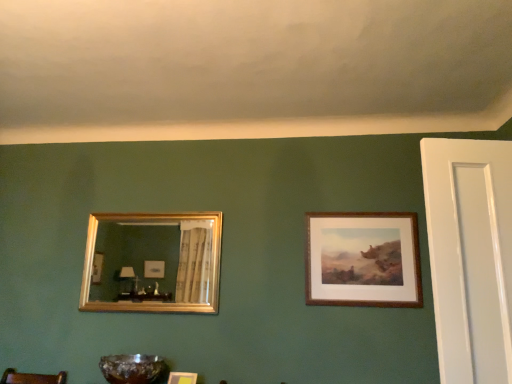
Find the location of a particular element. Image resolution: width=512 pixels, height=384 pixels. wooden picture frame at lower center, which is the 2th picture frame from left to right is located at coordinates (182, 378).

Based on the photo, how different are the orientations of wooden picture frame at lower center, which is counted as the second picture frame, starting from the right, and gold-framed mirror at left, which is the first picture frame from left to right, in degrees?

The angle between the facing direction of wooden picture frame at lower center, which is counted as the second picture frame, starting from the right, and the facing direction of gold-framed mirror at left, which is the first picture frame from left to right, is 0.134 degrees.

Locate an element on the screen. The width and height of the screenshot is (512, 384). picture frame that appears below the gold-framed mirror at left, the 3th picture frame in the right-to-left sequence (from the image's perspective) is located at coordinates (182, 378).

Who is bigger, wooden picture frame at lower center, which is the 2th picture frame from left to right, or gold-framed mirror at left, the 3th picture frame in the right-to-left sequence?

With larger size is gold-framed mirror at left, the 3th picture frame in the right-to-left sequence.

Considering the relative positions of wooden picture frame at lower center, which is counted as the second picture frame, starting from the right, and gold-framed mirror at left, which is the first picture frame from left to right, in the image provided, is wooden picture frame at lower center, which is counted as the second picture frame, starting from the right, behind gold-framed mirror at left, which is the first picture frame from left to right,?

No, it is in front of gold-framed mirror at left, which is the first picture frame from left to right.

Which is in front, point (129, 383) or point (183, 277)?

The point (129, 383) is more forward.

From the image's perspective, relative to gold-framed mirror at left, the 3th picture frame in the right-to-left sequence, is translucent amber glass bowl at lower center above or below?

Based on their image positions, translucent amber glass bowl at lower center is located beneath gold-framed mirror at left, the 3th picture frame in the right-to-left sequence.

From a real-world perspective, relative to gold-framed mirror at left, which is the first picture frame from left to right, is translucent amber glass bowl at lower center vertically above or below?

translucent amber glass bowl at lower center is situated lower than gold-framed mirror at left, which is the first picture frame from left to right, in the real world.

Which object is further away from the camera taking this photo, translucent amber glass bowl at lower center or brown wooden frame at upper right, the first picture frame positioned from the right?

brown wooden frame at upper right, the first picture frame positioned from the right, is more distant.

Is point (130, 367) in front of point (333, 282)?

Yes, point (130, 367) is closer to viewer.

Does translucent amber glass bowl at lower center have a larger size compared to brown wooden frame at upper right, marked as the third picture frame in a left-to-right arrangement?

Yes.

Identify the location of glass bowl on the left of brown wooden frame at upper right, marked as the third picture frame in a left-to-right arrangement. (131, 368).

From a real-world perspective, is brown wooden frame at upper right, the first picture frame positioned from the right, positioned above or below gold-framed mirror at left, the 3th picture frame in the right-to-left sequence?

Clearly, from a real-world perspective, brown wooden frame at upper right, the first picture frame positioned from the right, is above gold-framed mirror at left, the 3th picture frame in the right-to-left sequence.

Could you tell me if brown wooden frame at upper right, the first picture frame positioned from the right, is turned towards gold-framed mirror at left, which is the first picture frame from left to right?

No, brown wooden frame at upper right, the first picture frame positioned from the right, is not aimed at gold-framed mirror at left, which is the first picture frame from left to right.

Does brown wooden frame at upper right, marked as the third picture frame in a left-to-right arrangement, have a greater height compared to gold-framed mirror at left, which is the first picture frame from left to right?

No.

Does point (323, 229) come behind point (174, 258)?

No.

Is brown wooden frame at upper right, the first picture frame positioned from the right, in front of or behind translucent amber glass bowl at lower center in the image?

brown wooden frame at upper right, the first picture frame positioned from the right, is positioned farther from the viewer than translucent amber glass bowl at lower center.

Is brown wooden frame at upper right, the first picture frame positioned from the right, taller than translucent amber glass bowl at lower center?

Correct, brown wooden frame at upper right, the first picture frame positioned from the right, is much taller as translucent amber glass bowl at lower center.

Is brown wooden frame at upper right, the first picture frame positioned from the right, oriented away from translucent amber glass bowl at lower center?

No, brown wooden frame at upper right, the first picture frame positioned from the right,'s orientation is not away from translucent amber glass bowl at lower center.

From the image's perspective, is brown wooden frame at upper right, marked as the third picture frame in a left-to-right arrangement, on wooden picture frame at lower center, which is the 2th picture frame from left to right?

Yes.

Who is taller, brown wooden frame at upper right, the first picture frame positioned from the right, or wooden picture frame at lower center, which is the 2th picture frame from left to right?

brown wooden frame at upper right, the first picture frame positioned from the right, is taller.

Based on their sizes in the image, would you say brown wooden frame at upper right, marked as the third picture frame in a left-to-right arrangement, is bigger or smaller than wooden picture frame at lower center, which is counted as the second picture frame, starting from the right?

Clearly, brown wooden frame at upper right, marked as the third picture frame in a left-to-right arrangement, is larger in size than wooden picture frame at lower center, which is counted as the second picture frame, starting from the right.

Is brown wooden frame at upper right, marked as the third picture frame in a left-to-right arrangement, positioned with its back to wooden picture frame at lower center, which is counted as the second picture frame, starting from the right?

brown wooden frame at upper right, marked as the third picture frame in a left-to-right arrangement, is not turned away from wooden picture frame at lower center, which is counted as the second picture frame, starting from the right.

There is a brown wooden frame at upper right, marked as the third picture frame in a left-to-right arrangement. At what (x,y) coordinates should I click in order to perform the action: click on the 2nd picture frame below it (from the image's perspective). Please return your answer as a coordinate pair (x, y). This screenshot has height=384, width=512. Looking at the image, I should click on (182, 378).

Looking at this image, between wooden picture frame at lower center, which is the 2th picture frame from left to right, and brown wooden frame at upper right, marked as the third picture frame in a left-to-right arrangement, which one has smaller size?

With smaller size is wooden picture frame at lower center, which is the 2th picture frame from left to right.

Which is correct: wooden picture frame at lower center, which is the 2th picture frame from left to right, is inside brown wooden frame at upper right, the first picture frame positioned from the right, or outside of it?

wooden picture frame at lower center, which is the 2th picture frame from left to right, is not inside brown wooden frame at upper right, the first picture frame positioned from the right, it's outside.

This screenshot has width=512, height=384. I want to click on picture frame beneath the gold-framed mirror at left, which is the first picture frame from left to right (from a real-world perspective), so click(182, 378).

Locate an element on the screen. The height and width of the screenshot is (384, 512). the 1st picture frame to the right of the translucent amber glass bowl at lower center, starting your count from the anchor is located at coordinates (152, 262).

From the image, which object appears to be nearer to wooden picture frame at lower center, which is counted as the second picture frame, starting from the right, translucent amber glass bowl at lower center or brown wooden frame at upper right, the first picture frame positioned from the right?

translucent amber glass bowl at lower center is positioned closer to the anchor wooden picture frame at lower center, which is counted as the second picture frame, starting from the right.

Considering their positions, is translucent amber glass bowl at lower center positioned further to gold-framed mirror at left, the 3th picture frame in the right-to-left sequence, than brown wooden frame at upper right, marked as the third picture frame in a left-to-right arrangement?

brown wooden frame at upper right, marked as the third picture frame in a left-to-right arrangement.

When comparing their distances from translucent amber glass bowl at lower center, does wooden picture frame at lower center, which is the 2th picture frame from left to right, or brown wooden frame at upper right, marked as the third picture frame in a left-to-right arrangement, seem closer?

Among the two, wooden picture frame at lower center, which is the 2th picture frame from left to right, is located nearer to translucent amber glass bowl at lower center.

Based on their spatial positions, is brown wooden frame at upper right, the first picture frame positioned from the right, or translucent amber glass bowl at lower center closer to gold-framed mirror at left, the 3th picture frame in the right-to-left sequence?

translucent amber glass bowl at lower center.

Looking at the image, which one is located further to wooden picture frame at lower center, which is counted as the second picture frame, starting from the right, gold-framed mirror at left, which is the first picture frame from left to right, or translucent amber glass bowl at lower center?

Among the two, gold-framed mirror at left, which is the first picture frame from left to right, is located further to wooden picture frame at lower center, which is counted as the second picture frame, starting from the right.

Which object lies further to the anchor point translucent amber glass bowl at lower center, brown wooden frame at upper right, marked as the third picture frame in a left-to-right arrangement, or wooden picture frame at lower center, which is the 2th picture frame from left to right?

brown wooden frame at upper right, marked as the third picture frame in a left-to-right arrangement, is further to translucent amber glass bowl at lower center.

Estimate the real-world distances between objects in this image. Which object is closer to wooden picture frame at lower center, which is counted as the second picture frame, starting from the right, translucent amber glass bowl at lower center or gold-framed mirror at left, which is the first picture frame from left to right?

translucent amber glass bowl at lower center is closer to wooden picture frame at lower center, which is counted as the second picture frame, starting from the right.

From the image, which object appears to be nearer to brown wooden frame at upper right, marked as the third picture frame in a left-to-right arrangement, wooden picture frame at lower center, which is counted as the second picture frame, starting from the right, or translucent amber glass bowl at lower center?

Among the two, wooden picture frame at lower center, which is counted as the second picture frame, starting from the right, is located nearer to brown wooden frame at upper right, marked as the third picture frame in a left-to-right arrangement.

The width and height of the screenshot is (512, 384). Identify the location of picture frame located between gold-framed mirror at left, the 3th picture frame in the right-to-left sequence, and brown wooden frame at upper right, the first picture frame positioned from the right, in the left-right direction. (182, 378).

Find the location of a particular element. Image resolution: width=512 pixels, height=384 pixels. glass bowl between gold-framed mirror at left, the 3th picture frame in the right-to-left sequence, and wooden picture frame at lower center, which is counted as the second picture frame, starting from the right, in the up-down direction is located at coordinates (131, 368).